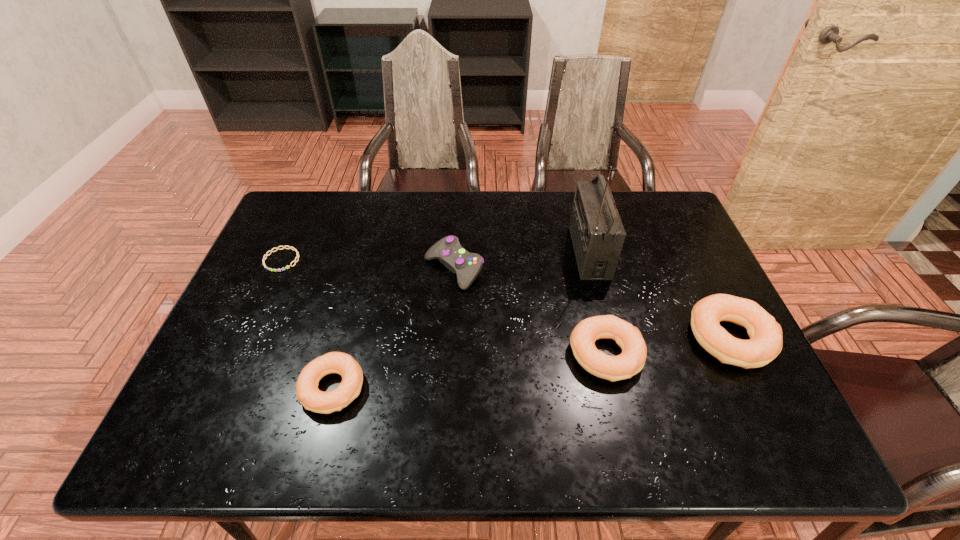
You are a GUI agent. You are given a task and a screenshot of the screen. Output one action in this format:
    pyautogui.click(x=<x>, y=<y>)
    Task: Click on the free space located on the left of the rightmost bagel
    
    Given the screenshot: What is the action you would take?
    click(x=610, y=339)

Find the location of a particular element. The width and height of the screenshot is (960, 540). vacant region located on the front of the control is located at coordinates (445, 408).

The height and width of the screenshot is (540, 960). Identify the location of vacant point located on the front panel of the radio receiver. (530, 252).

The height and width of the screenshot is (540, 960). What are the coordinates of `free location located 0.330m on the front panel of the radio receiver` in the screenshot? It's located at (465, 252).

Where is `free spot located on the front panel of the radio receiver`? This screenshot has width=960, height=540. free spot located on the front panel of the radio receiver is located at coordinates (514, 252).

I want to click on vacant area located 0.380m on the surface of the shortest object showing star-shaped elements, so click(224, 390).

Identify the location of object that is at the far edge. The height and width of the screenshot is (540, 960). (597, 232).

The image size is (960, 540). I want to click on object that is at the left edge, so click(290, 247).

Where is `object that is at the right edge`? The width and height of the screenshot is (960, 540). object that is at the right edge is located at coordinates (765, 343).

At what (x,y) coordinates should I click in order to perform the action: click on vacant space at the far edge. Please return your answer as a coordinate pair (x, y). The height and width of the screenshot is (540, 960). Looking at the image, I should click on (461, 224).